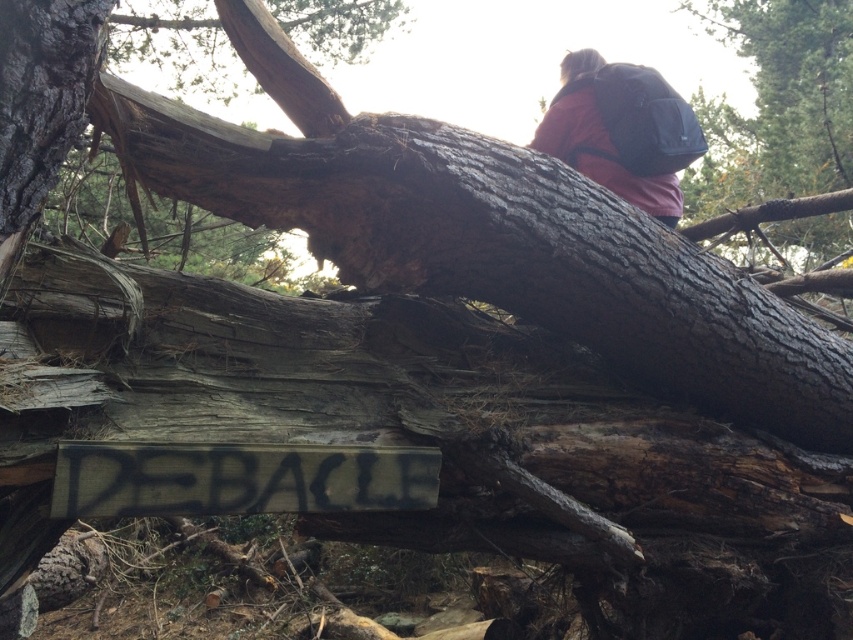
From the picture: You are standing at the center of the forest scene looking towards the wooden sign with the word DEBACLE. Where is the point located at coordinates (776,104) in relation to the dark brown bark at upper right?

The point at coordinates (776,104) corresponds to the dark brown bark at upper right.

From the picture: You are a hiker who has just spotted a wooden sign with the word DEBACLE in graffiti. You see the dark brown bark at upper right and the red fabric backpack at upper right. Which object is higher up in the scene?

The dark brown bark at upper right is above the red fabric backpack at upper right, so the dark brown bark at upper right is higher up in the scene.